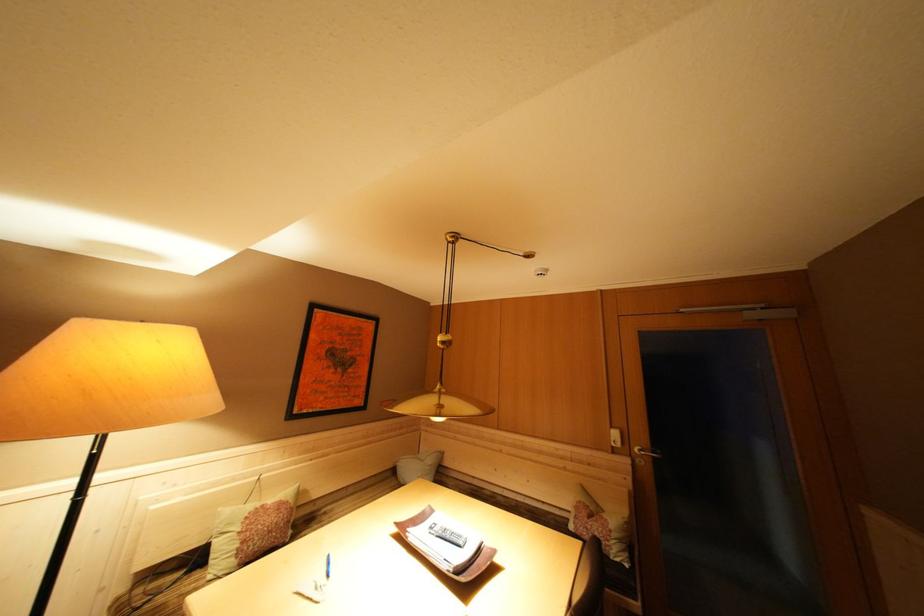
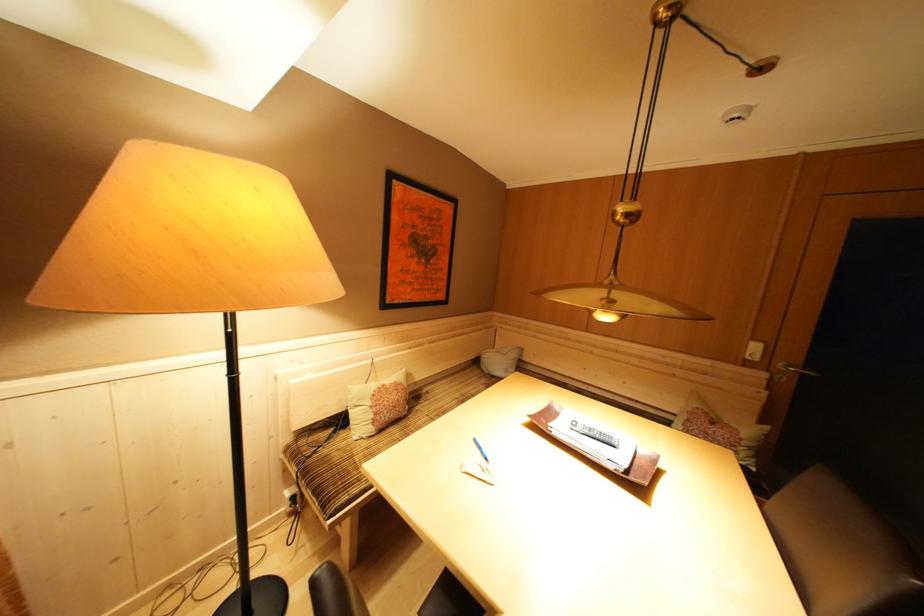
Question: The first image is from the beginning of the video and the second image is from the end. How did the camera likely rotate when shooting the video?

Choices:
 (A) Left
 (B) Right
 (C) Up
 (D) Down

Answer: (D)